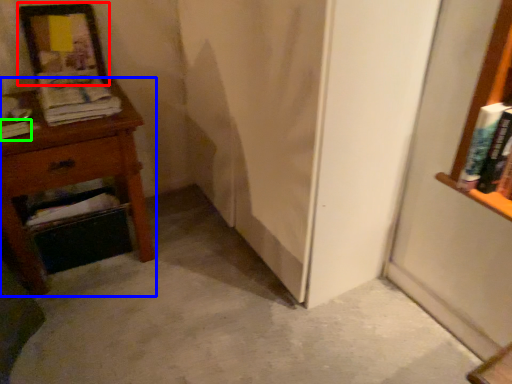
Question: Which is nearer to the picture frame (highlighted by a red box)? nightstand (highlighted by a blue box) or book (highlighted by a green box).

Choices:
 (A) nightstand
 (B) book

Answer: (A)